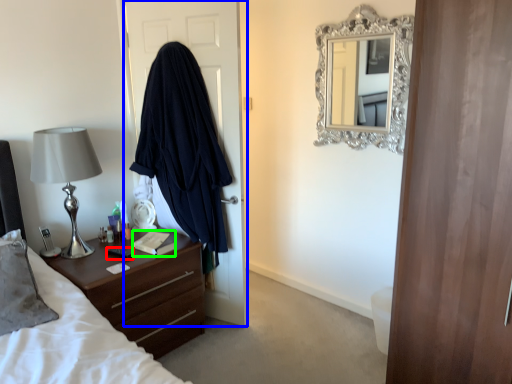
Question: Which object is the closest to the remote control (highlighted by a red box)? Choose among these: door (highlighted by a blue box) or book (highlighted by a green box).

Choices:
 (A) door
 (B) book

Answer: (B)